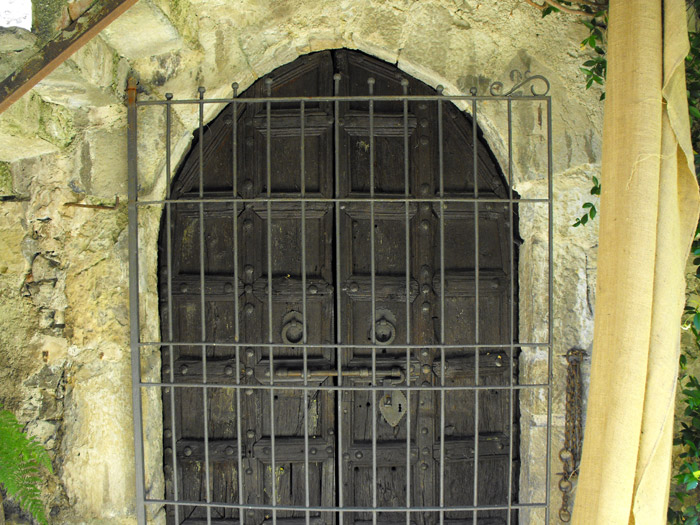
Identify the location of door knocker. (392, 327).